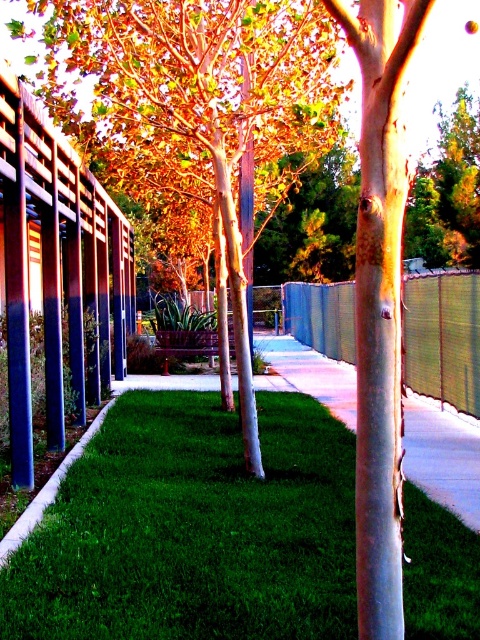
Question: Which point is farther to the camera?

Choices:
 (A) metallic woven fence at center
 (B) green grass at center

Answer: (A)

Question: Can you confirm if green grass at center is positioned to the left of metallic woven fence at center?

Choices:
 (A) no
 (B) yes

Answer: (B)

Question: Is the position of smooth white tree at center more distant than that of metallic woven fence at center?

Choices:
 (A) no
 (B) yes

Answer: (A)

Question: Does green grass at center appear on the right side of metallic woven fence at center?

Choices:
 (A) no
 (B) yes

Answer: (A)

Question: Among these points, which one is farthest from the camera?

Choices:
 (A) (118, 566)
 (B) (298, 321)
 (C) (335, 44)

Answer: (B)

Question: Which of the following is the farthest from the observer?

Choices:
 (A) green grass at center
 (B) smooth white tree at center

Answer: (B)